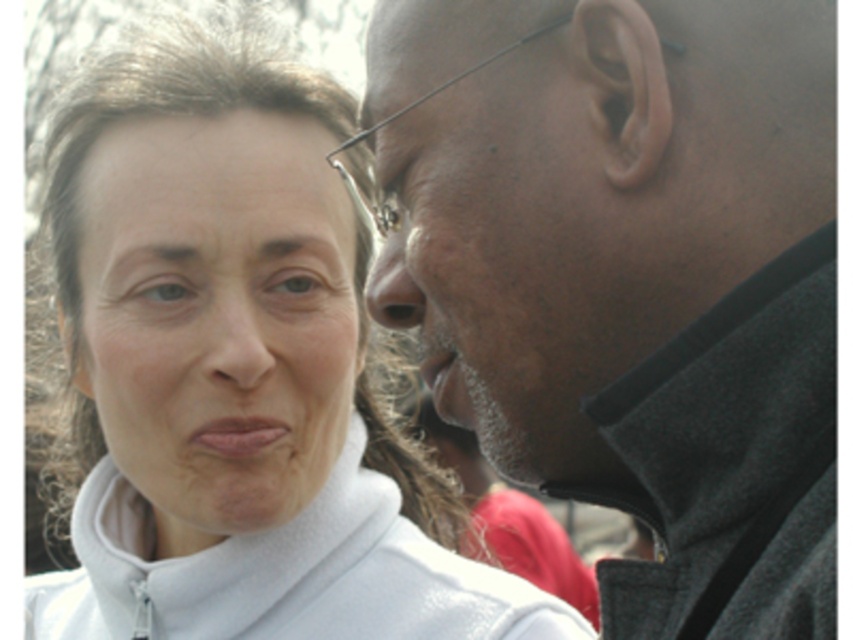
You are standing at the point labeled point (x=56, y=572) and want to move forward to the point labeled point (x=265, y=344). Is there any obstruction between you and your destination?

Point (x=56, y=572) is behind point (x=265, y=344), so there is no obstruction between them. You can move forward directly to the destination.

You are a photographer trying to capture a candid shot of the white matte face at upper left and the gray fleece jacket at right. Since you want to ensure both subjects are in focus, which one should you focus on first to maximize the chances of both being sharp?

The gray fleece jacket at right is positioned on the right side of white matte face at upper left. To maximize the chances of both being sharp, focus on the white matte face at upper left first since it is closer to the camera, and the gray fleece jacket at right will fall within the depth of field.

Consider the image. You are a photographer holding a camera and want to take a portrait of the gray fleece jacket at right. To ensure the jacket is in focus, you need to adjust the camera focus. What is the minimum distance you should set the focus to in inches?

The minimum focus distance should be set to 37.34 inches to ensure the gray fleece jacket at right is in focus since it is exactly that distance away from the camera.